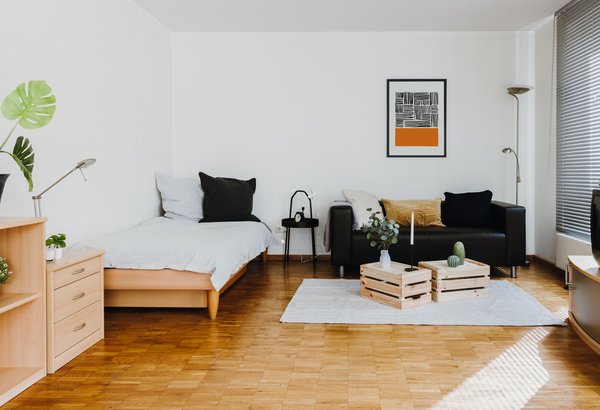
The height and width of the screenshot is (410, 600). I want to click on tube television, so click(x=595, y=244).